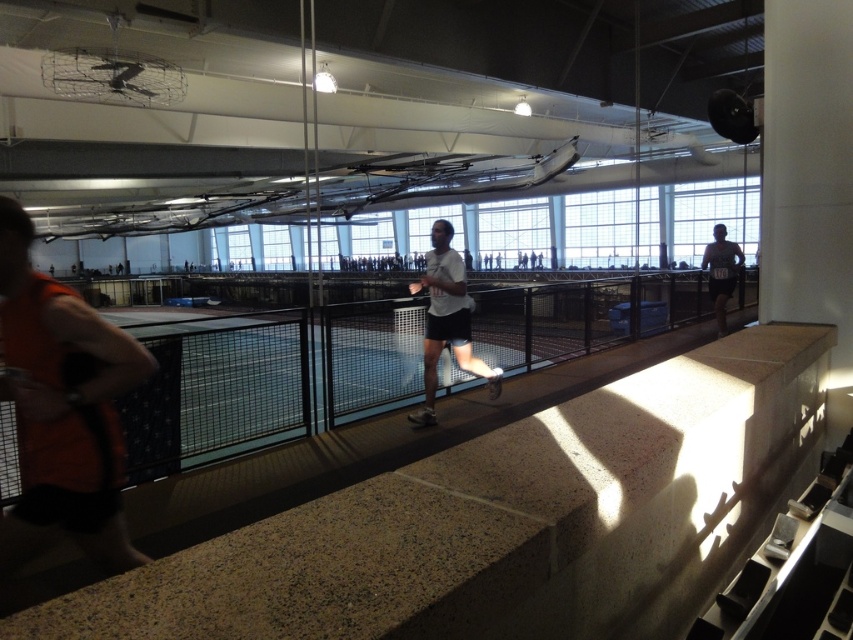
You are an athlete preparing to sprint on the indoor track. You notice a speckled concrete ledge at center and an orange fabric shirt at left in your path. Which object is located higher relative to the other?

The speckled concrete ledge at center is positioned over the orange fabric shirt at left, meaning it is higher than the shirt.

You are standing on the speckled concrete ledge at center and want to hand something to the person wearing the orange fabric shirt at left. Can you directly hand them the item without moving from your current position?

The speckled concrete ledge at center is in front of the orange fabric shirt at left, so you cannot directly hand them the item without moving because the ledge is blocking your path.